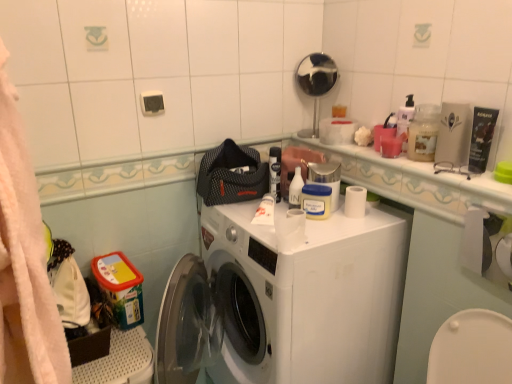
Where is `free space to the left of translucent plastic container at upper right`? The image size is (512, 384). free space to the left of translucent plastic container at upper right is located at coordinates (386, 159).